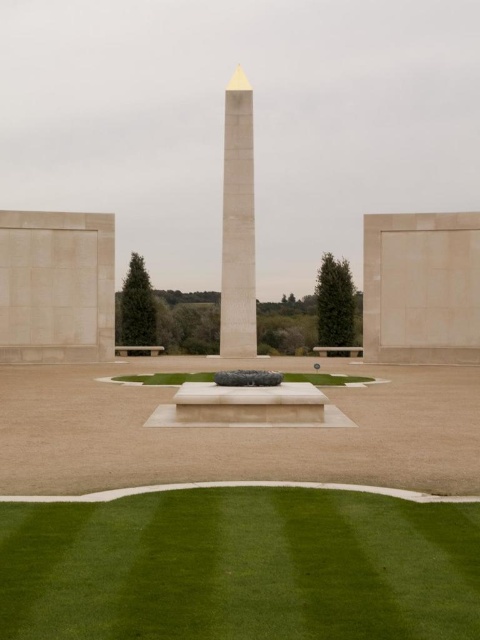
You are standing at the memorial site and want to take a photo of the obelisk. The camera you are using has a maximum focus range of 100 feet. Will the camera be able to focus on the point at point (x=20, y=272)?

The point at point (x=20, y=272) is 109.51 feet away from the camera, which exceeds the maximum focus range of 100 feet. Therefore, the camera will not be able to focus on that point.

You are standing at the memorial site and want to place a wreath on the green smooth lawn at center. However, you notice the white polished stone obelisk at center might block your view. From your current position, which side of the obelisk should you walk to in order to access the lawn without obstruction?

The green smooth lawn at center is located to the right of the white polished stone obelisk at center. To access it without obstruction, you should walk to the right side of the obelisk.